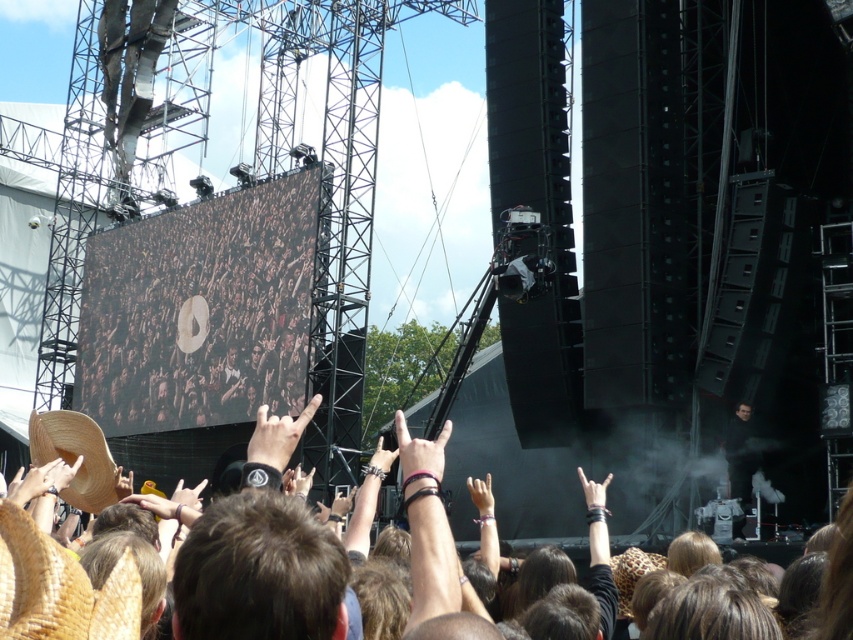
You are a photographer at the concert and want to capture both the natural straw hat at lower left and the brown woven cowboy hat at lower left in a single shot. Which hat will appear bigger in the photo?

The natural straw hat at lower left will appear bigger in the photo because it is larger in size than the brown woven cowboy hat at lower left.

You are a photographer at the concert trying to capture a photo of the natural straw hat at lower left without the brown matte crowd at center blocking it. What should you do?

Since the brown matte crowd at center is taller than the natural straw hat at lower left, you can lower your camera angle to avoid the crowd blocking the hat.

In the scene shown: You are a photographer at the concert and want to capture both the natural straw hat at lower left and the brown woven cowboy hat at lower left in a single shot. Which hat should you adjust your camera to focus on first to ensure both are in frame?

You should focus on the brown woven cowboy hat at lower left first because it is positioned to the left of the natural straw hat at lower left, so adjusting focus on it ensures the natural straw hat at lower left will also be captured in the frame.